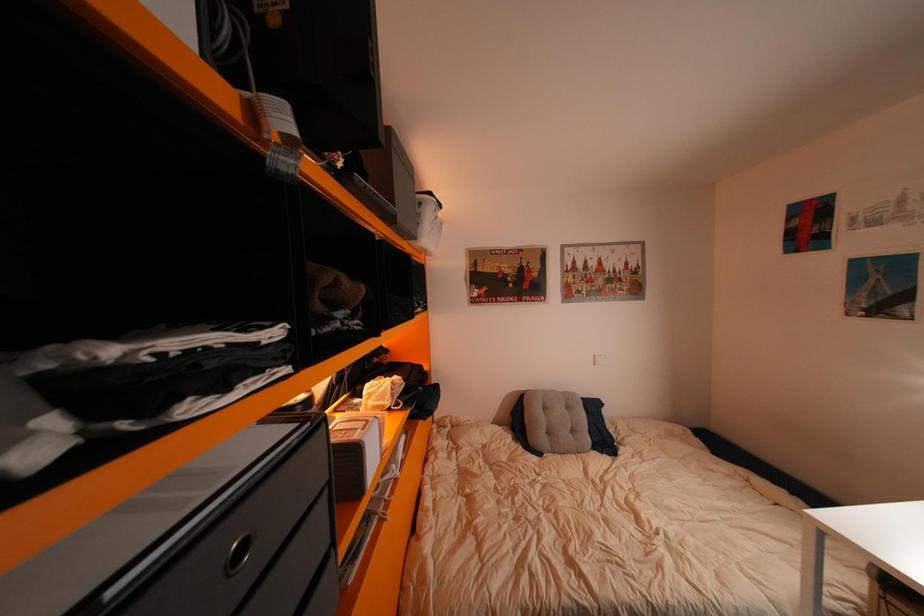
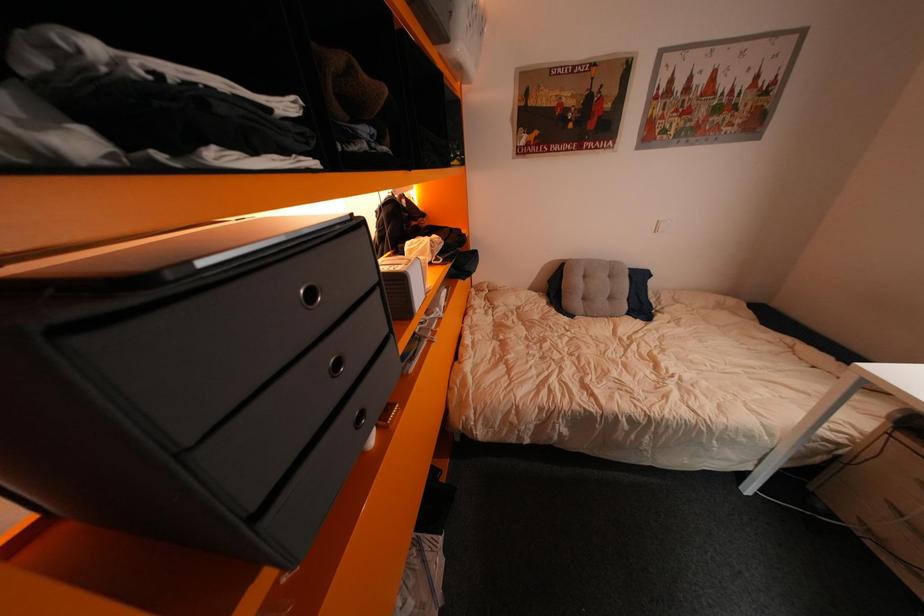
Question: The images are taken continuously from a first-person perspective. In which direction is your viewpoint rotating?

Choices:
 (A) Left
 (B) Right
 (C) Up
 (D) Down

Answer: (D)